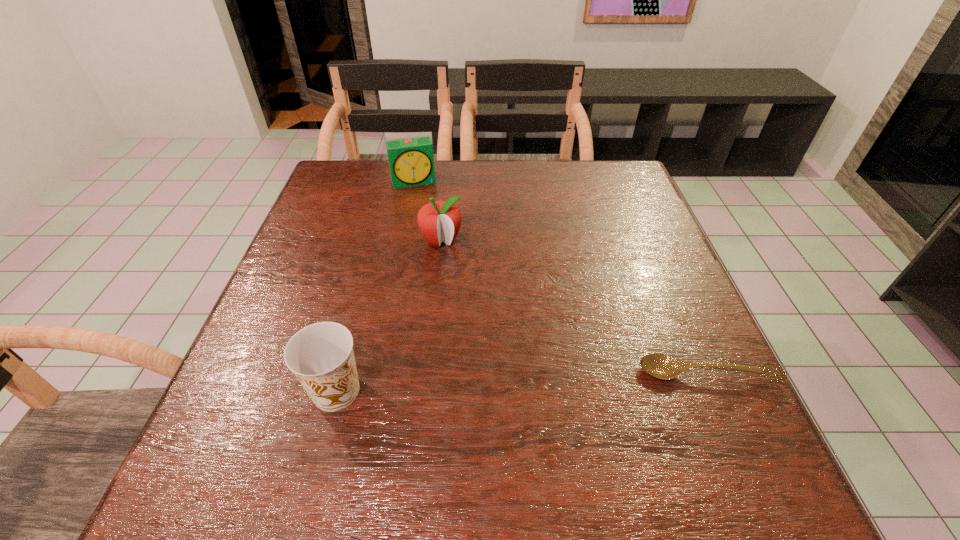
The image size is (960, 540). What are the coordinates of `Dixie cup` in the screenshot? It's located at [321, 356].

Image resolution: width=960 pixels, height=540 pixels. I want to click on the rightmost object, so click(x=662, y=366).

Where is `ladle`? The image size is (960, 540). ladle is located at coordinates (662, 366).

I want to click on the farthest object, so click(411, 161).

You are a GUI agent. You are given a task and a screenshot of the screen. Output one action in this format:
    pyautogui.click(x=<x>, y=<y>)
    Task: Click on the second farthest object
    
    Given the screenshot: What is the action you would take?
    pyautogui.click(x=438, y=221)

Locate an element on the screen. This screenshot has width=960, height=540. vacant space located 0.280m on the back of the Dixie cup is located at coordinates (370, 265).

This screenshot has height=540, width=960. I want to click on vacant space located on the left of the shortest object, so click(612, 373).

Where is `free space located on the front-facing side of the farthest object`? The height and width of the screenshot is (540, 960). free space located on the front-facing side of the farthest object is located at coordinates (435, 248).

Locate an element on the screen. vacant space located on the front-facing side of the farthest object is located at coordinates (426, 218).

You are a GUI agent. You are given a task and a screenshot of the screen. Output one action in this format:
    pyautogui.click(x=<x>, y=<y>)
    Task: Click on the free space located 0.300m on the front-facing side of the farthest object
    The width and height of the screenshot is (960, 540).
    Given the screenshot: What is the action you would take?
    [x=438, y=256]